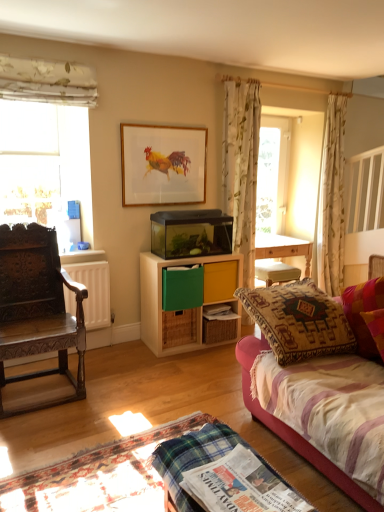
Locate an element on the screen. Image resolution: width=384 pixels, height=512 pixels. free space in front of wooden storage unit at center is located at coordinates (192, 361).